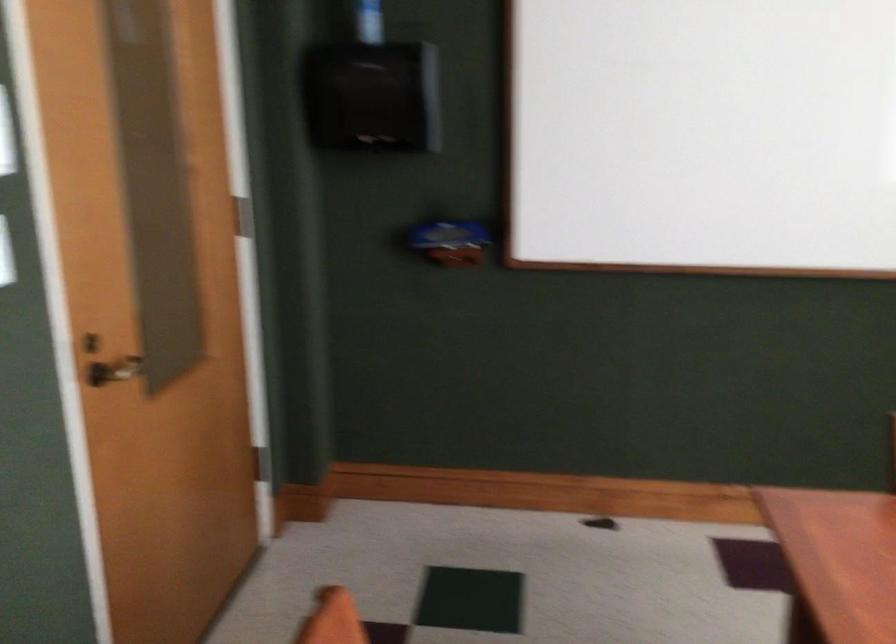
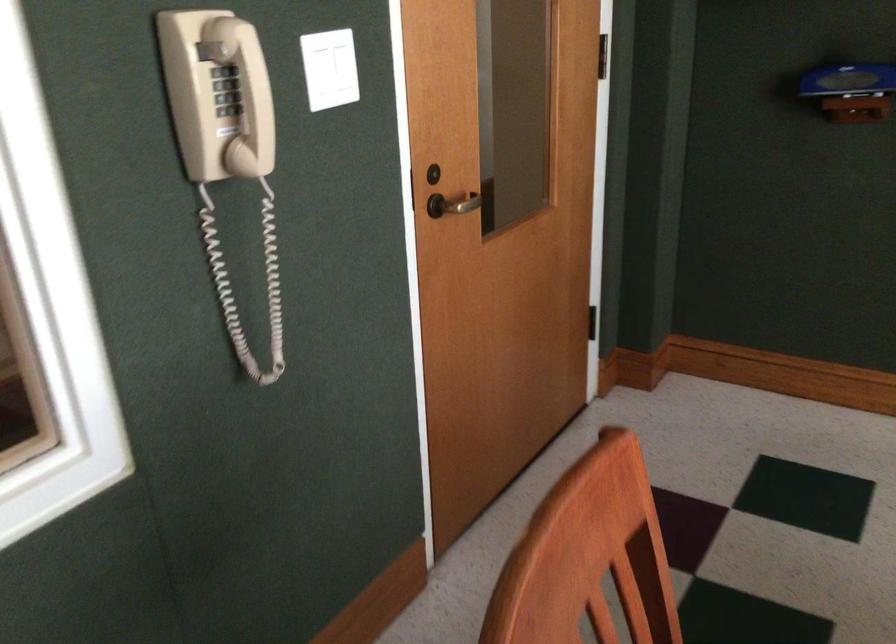
Question: The images are taken continuously from a first-person perspective. In which direction are you moving?

Choices:
 (A) Left
 (B) Right
 (C) Forward
 (D) Backward

Answer: (C)